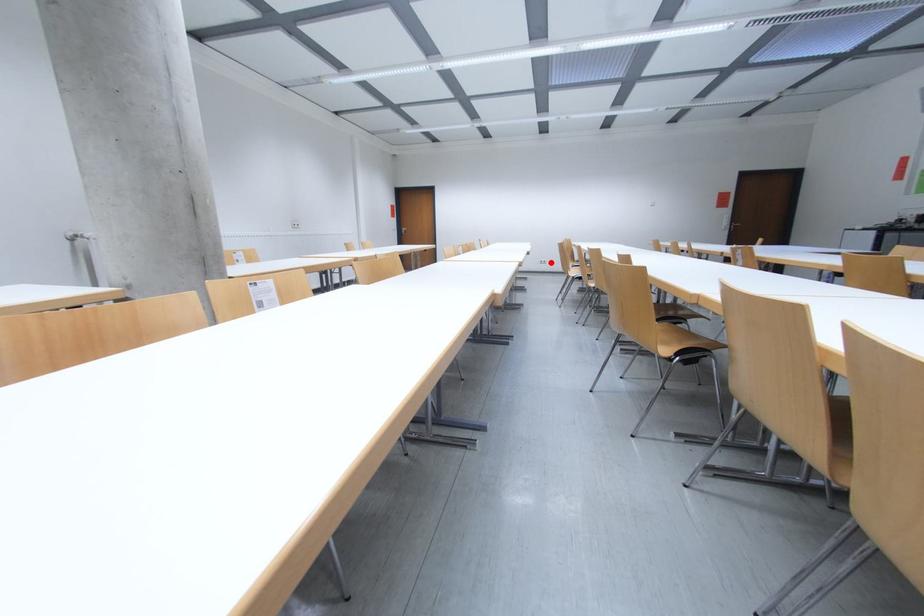
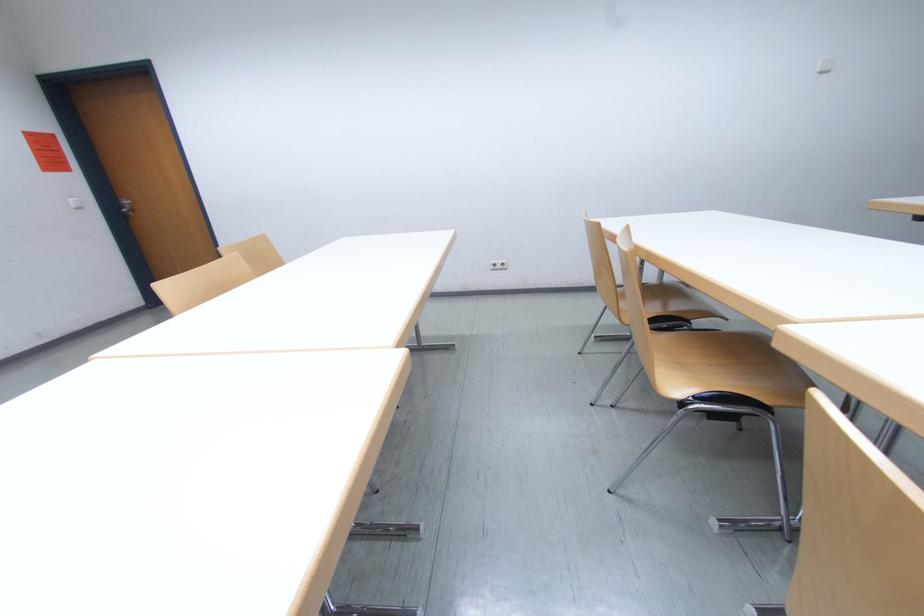
In the second image, find the point that corresponds to the highlighted location in the first image.

(505, 265)